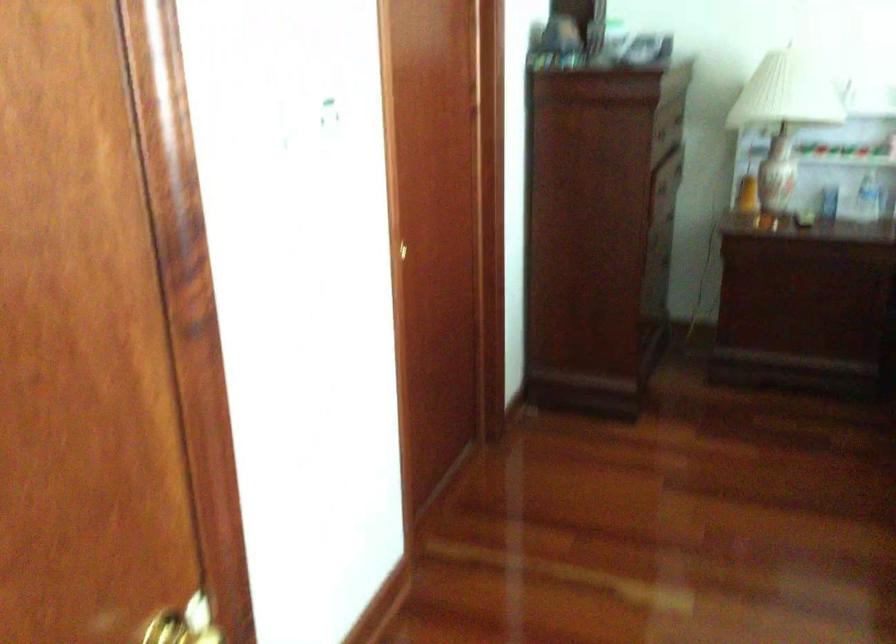
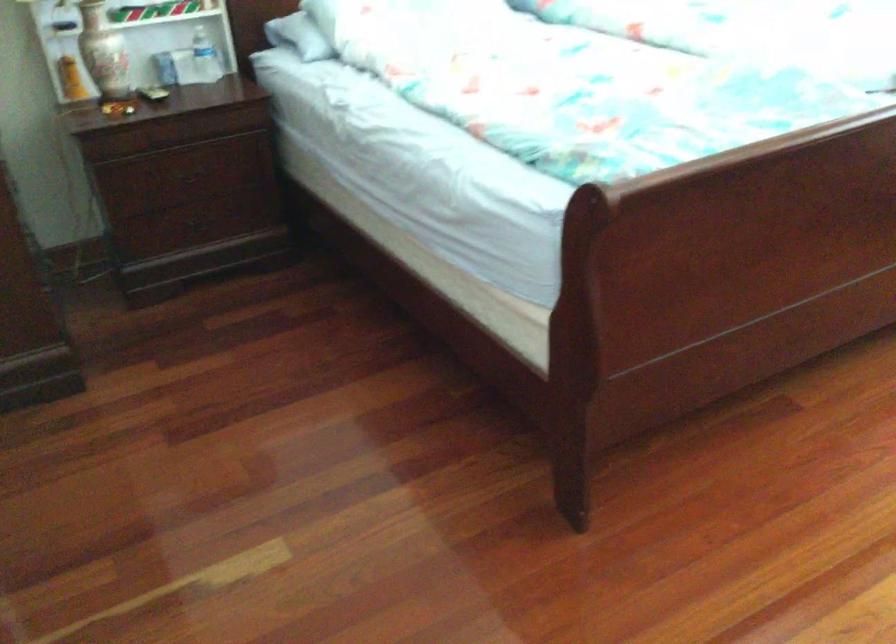
Question: The camera is either moving clockwise (left) or counter-clockwise (right) around the object. The first image is from the beginning of the video and the second image is from the end. Is the camera moving left or right when shooting the video?

Choices:
 (A) Left
 (B) Right

Answer: (A)